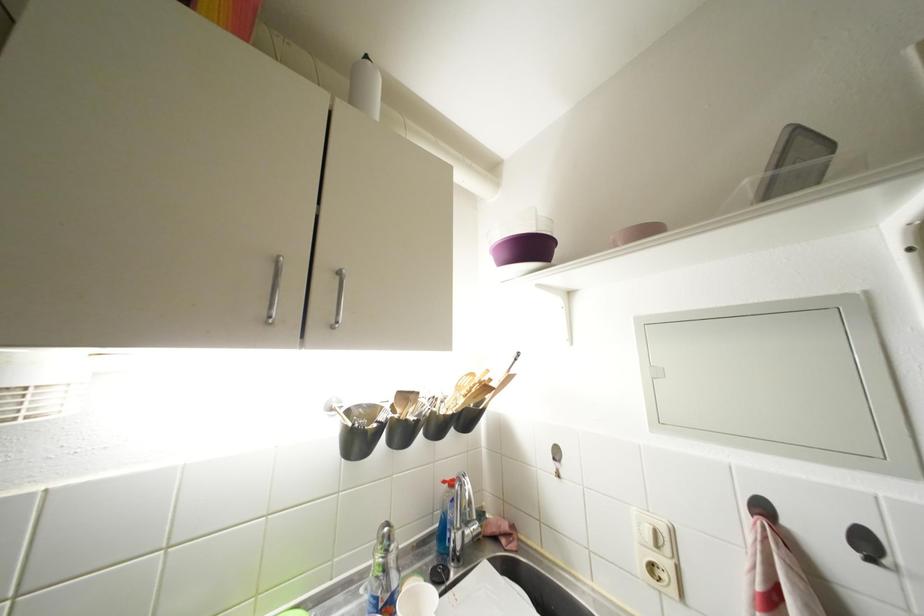
Identify the location of silver faucet handle. This screenshot has width=924, height=616. (462, 521).